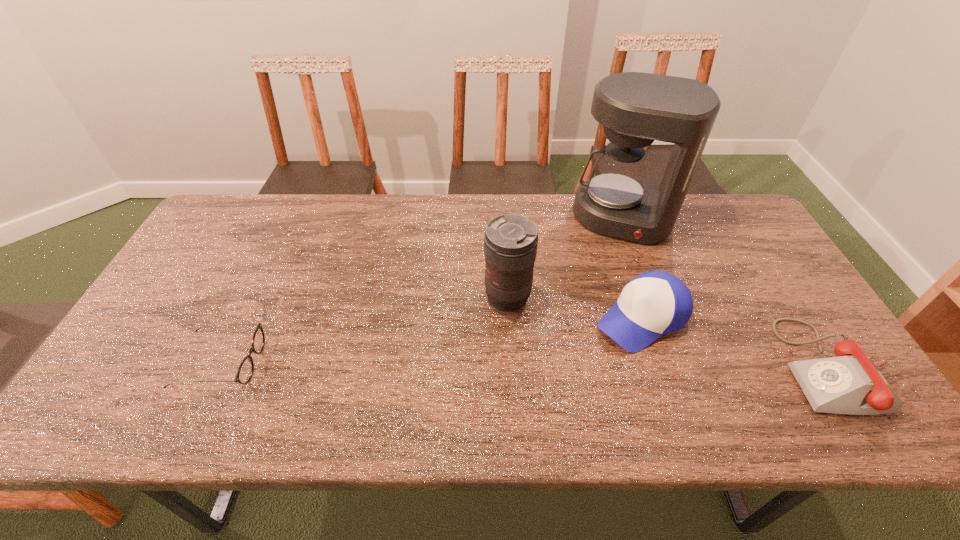
Identify the location of free space located 0.110m on the dial of the telephone. (739, 367).

Locate an element on the screen. The width and height of the screenshot is (960, 540). vacant space located on the dial of the telephone is located at coordinates (760, 367).

The width and height of the screenshot is (960, 540). I want to click on vacant space located on the dial of the telephone, so click(709, 367).

The width and height of the screenshot is (960, 540). I want to click on free space located 0.050m on the side of the second object from left to right where the control switches are located, so click(480, 323).

This screenshot has width=960, height=540. Identify the location of vacant region located 0.280m on the side of the second object from left to right where the control switches are located. (418, 383).

This screenshot has width=960, height=540. What are the coordinates of `free space located 0.240m on the side of the second object from left to right where the control switches are located` in the screenshot? It's located at (429, 372).

Where is `free location located 0.330m on the front-facing side of the farthest object`? The width and height of the screenshot is (960, 540). free location located 0.330m on the front-facing side of the farthest object is located at coordinates pos(595,326).

Where is `vacant space located on the front-facing side of the farthest object`? vacant space located on the front-facing side of the farthest object is located at coordinates (591, 343).

Find the location of a particular element. free space located 0.140m on the front-facing side of the farthest object is located at coordinates (607, 276).

At what (x,y) coordinates should I click in order to perform the action: click on free space located on the front-facing side of the third shortest object. Please return your answer as a coordinate pair (x, y). This screenshot has height=540, width=960. Looking at the image, I should click on (569, 363).